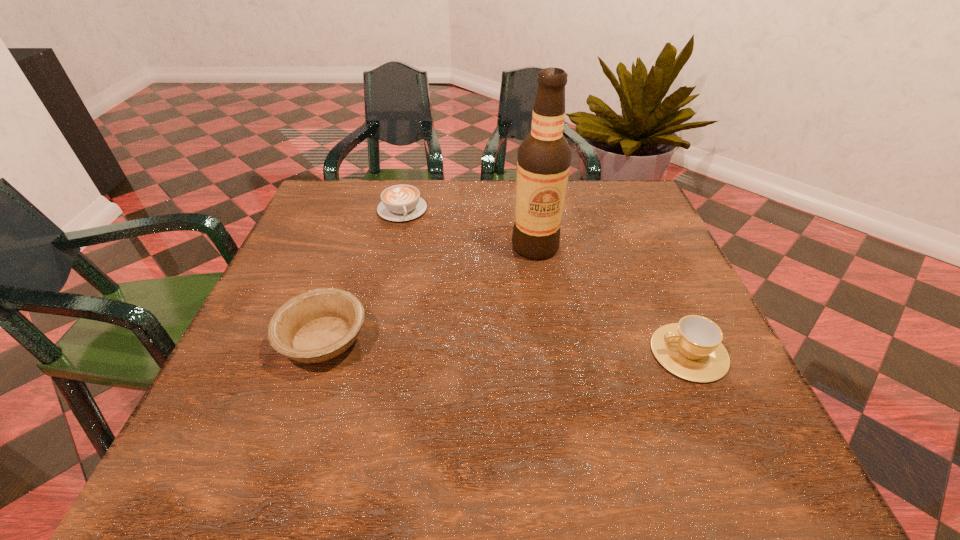
Identify the location of vacant spot on the desktop that is between the bowl and the cup and is positioned on the side of the shortest object with the handle. The width and height of the screenshot is (960, 540). (450, 344).

Locate an element on the screen. This screenshot has width=960, height=540. vacant space on the desktop that is between the bowl and the rightmost object and is positioned on the label of the tallest object is located at coordinates (491, 346).